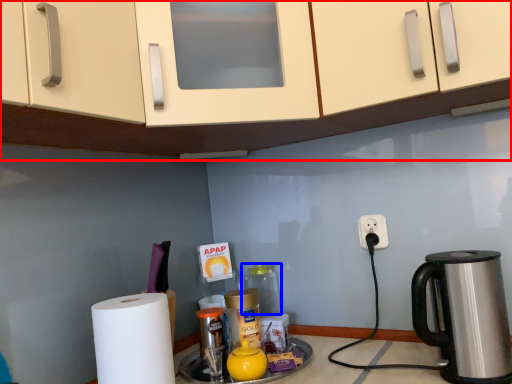
Question: Which point is further to the camera, cabinetry (highlighted by a red box) or bottle (highlighted by a blue box)?

Choices:
 (A) cabinetry
 (B) bottle

Answer: (B)